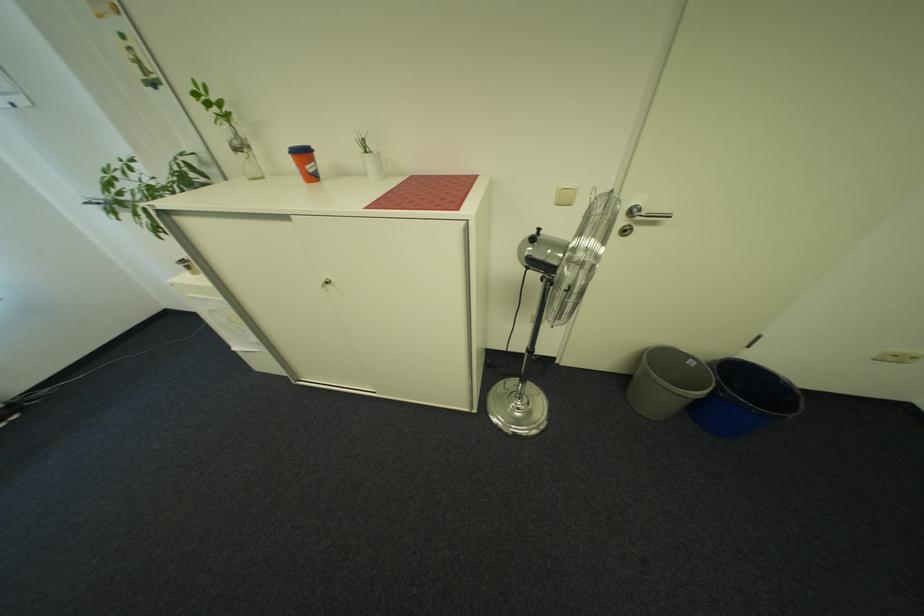
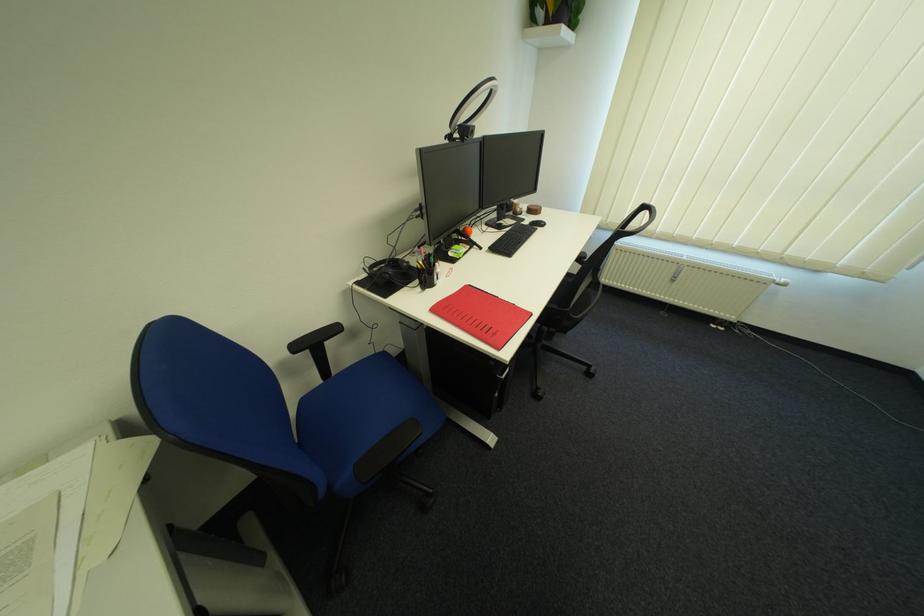
Based on the continuous images, in which direction is the camera rotating?

The camera's rotation is toward left-down.